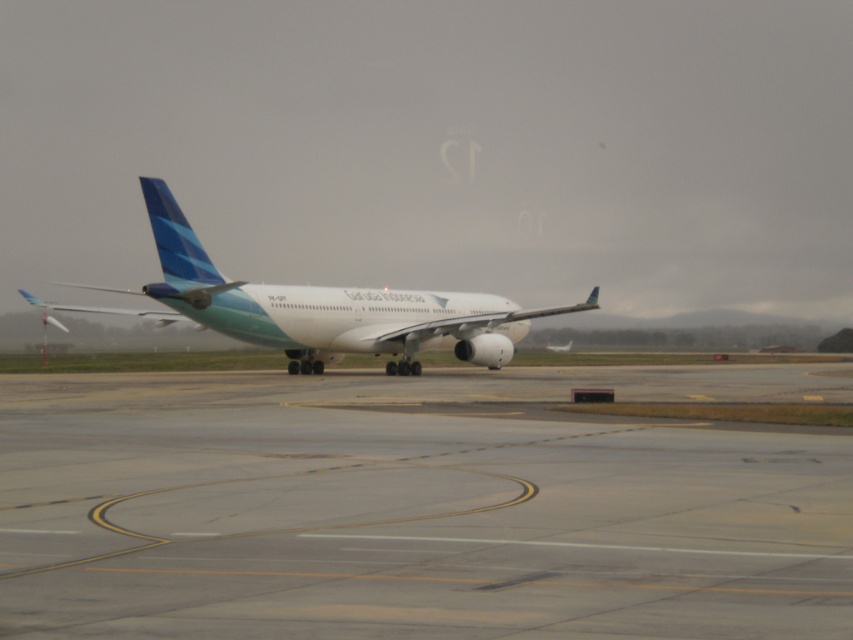
Question: From the image, what is the correct spatial relationship of gray asphalt runway at center in relation to white glossy airplane at center?

Choices:
 (A) below
 (B) above

Answer: (A)

Question: Observing the image, what is the correct spatial positioning of gray asphalt runway at center in reference to white glossy airplane at center?

Choices:
 (A) above
 (B) below

Answer: (B)

Question: Is gray asphalt runway at center bigger than white glossy airplane at center?

Choices:
 (A) yes
 (B) no

Answer: (B)

Question: Which point is closer to the camera?

Choices:
 (A) white glossy airplane at center
 (B) gray asphalt runway at center

Answer: (B)